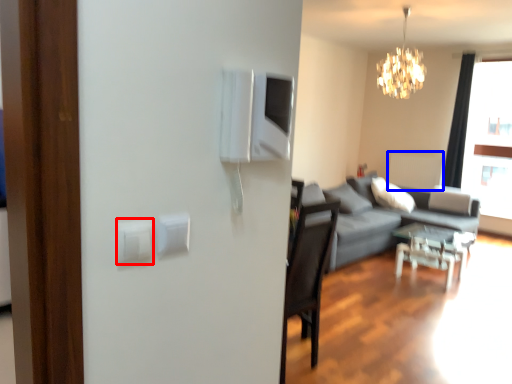
Question: Which point is closer to the camera, light switch (highlighted by a red box) or radiator (highlighted by a blue box)?

Choices:
 (A) light switch
 (B) radiator

Answer: (A)